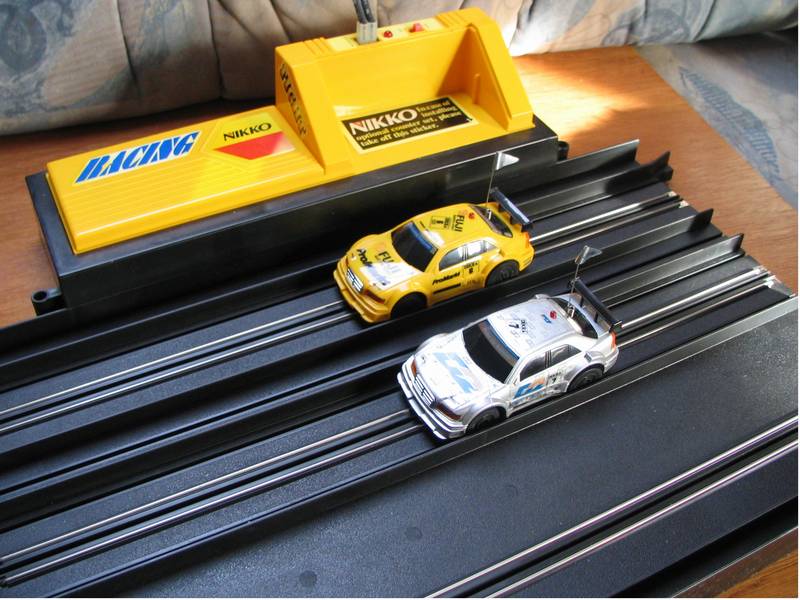
This screenshot has height=600, width=800. In order to click on wooden board in this screenshot , I will do `click(754, 230)`.